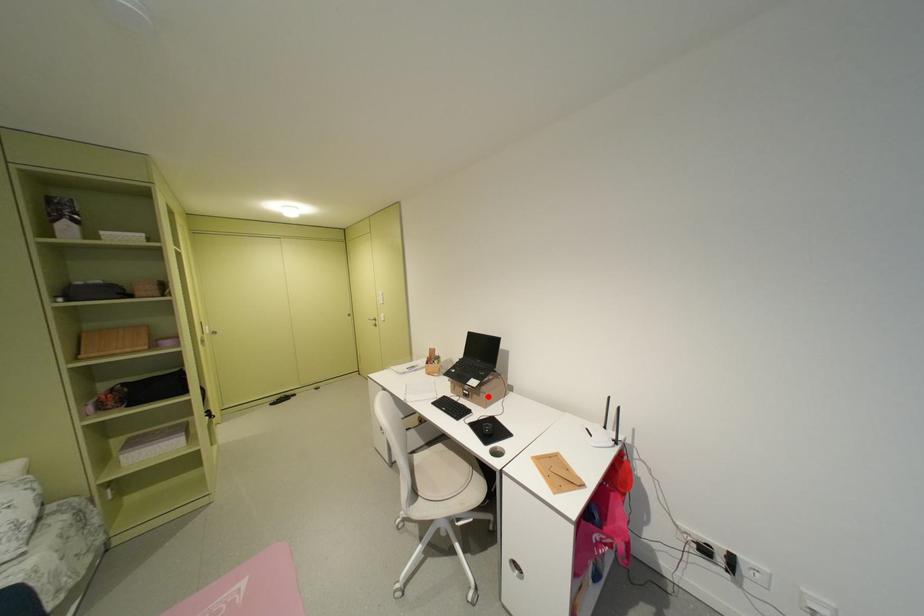
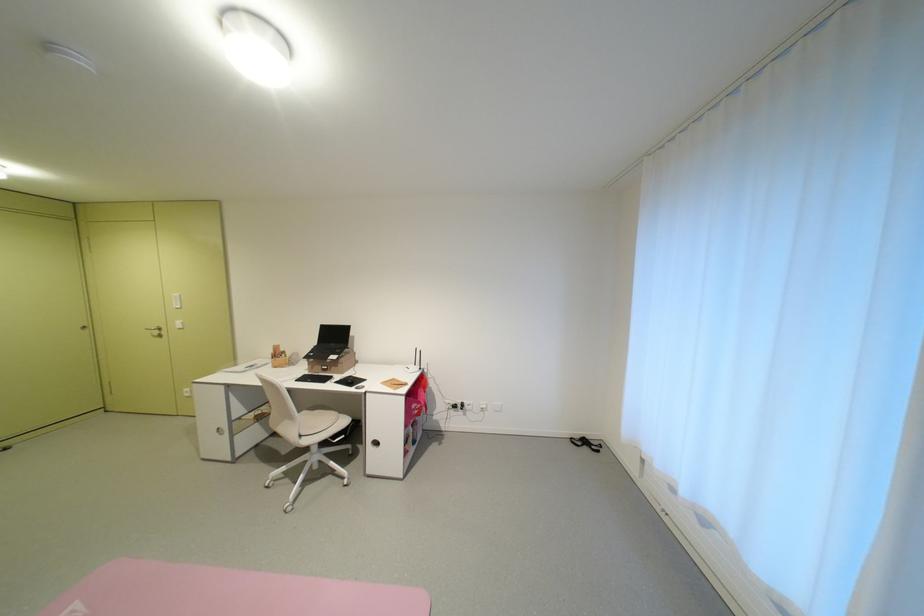
Locate, in the second image, the point that corresponds to the highlighted location in the first image.

(346, 368)